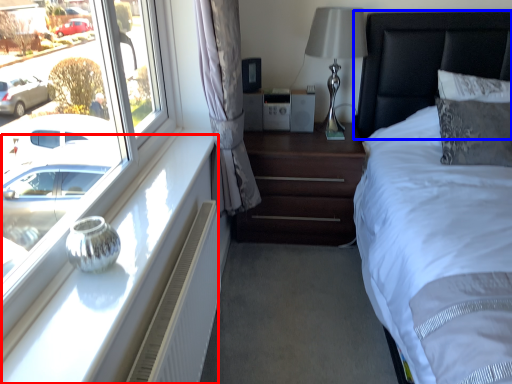
Question: Among these objects, which one is farthest to the camera, window sill (highlighted by a red box) or headboard (highlighted by a blue box)?

Choices:
 (A) window sill
 (B) headboard

Answer: (B)